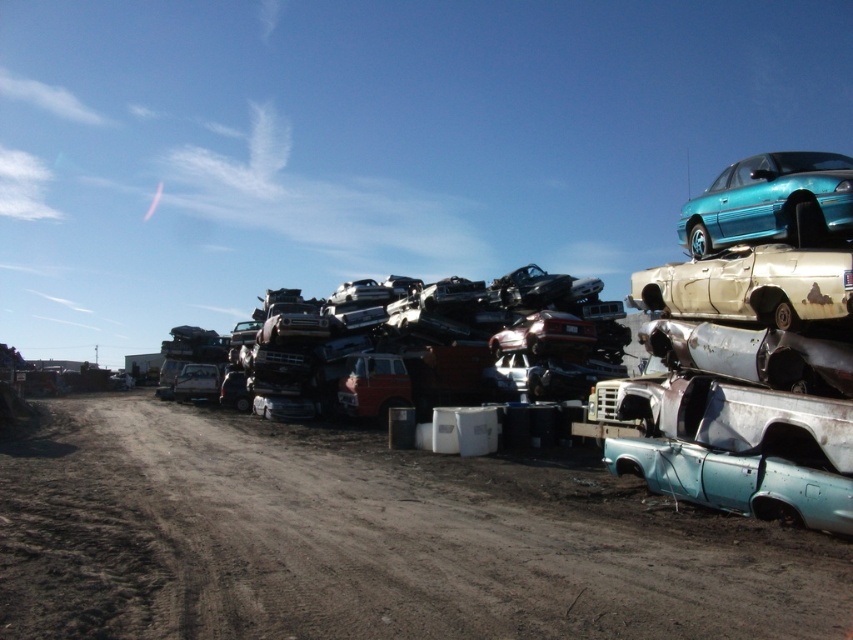
You are standing at the center of the junkyard and want to find the dirt track at lower left. According to the coordinates given, in which direction should you move to reach it?

The dirt track at lower left is located at coordinates point (367, 541). Since you are at the center, you should move towards the lower left direction to reach it.

You are a delivery truck driver who needs to turn around on the dirt track at lower left. Considering the size of the teal glossy car at upper right parked nearby, do you think there is enough space to make a U turn?

The dirt track at lower left is bigger than the teal glossy car at upper right, so there should be enough space to make a U turn as the track is larger than the car.